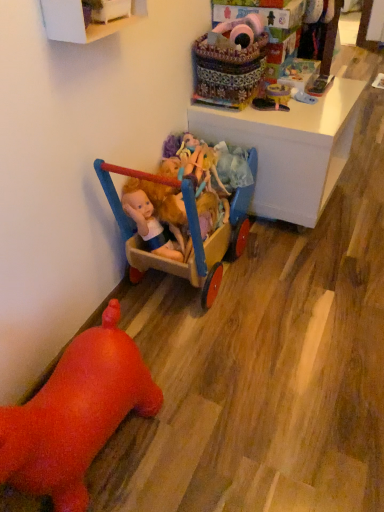
This screenshot has height=512, width=384. I want to click on free space that is in between white glossy desk at upper center and wooden cart at center, the 2th toy positioned from the bottom, so click(270, 270).